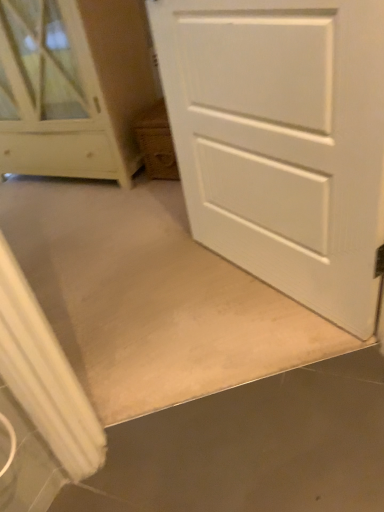
Question: Does point (304, 295) appear closer or farther from the camera than point (39, 19)?

Choices:
 (A) farther
 (B) closer

Answer: (B)

Question: Is white matte door at center spatially inside white wood chest of drawers at upper left, or outside of it?

Choices:
 (A) inside
 (B) outside

Answer: (B)

Question: Looking at the image, does white matte door at center seem bigger or smaller compared to white wood chest of drawers at upper left?

Choices:
 (A) small
 (B) big

Answer: (A)

Question: Is white wood chest of drawers at upper left in front of or behind white matte door at center in the image?

Choices:
 (A) behind
 (B) front

Answer: (A)

Question: Considering the positions of point (26, 41) and point (355, 287), is point (26, 41) closer or farther from the camera than point (355, 287)?

Choices:
 (A) farther
 (B) closer

Answer: (A)

Question: From the image's perspective, relative to white matte door at center, is white wood chest of drawers at upper left above or below?

Choices:
 (A) above
 (B) below

Answer: (A)

Question: From a real-world perspective, is white wood chest of drawers at upper left positioned above or below white matte door at center?

Choices:
 (A) above
 (B) below

Answer: (A)